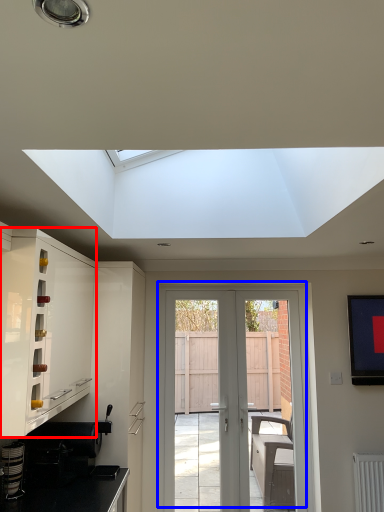
Question: Which of the following is the closest to the observer, cabinetry (highlighted by a red box) or door (highlighted by a blue box)?

Choices:
 (A) cabinetry
 (B) door

Answer: (A)